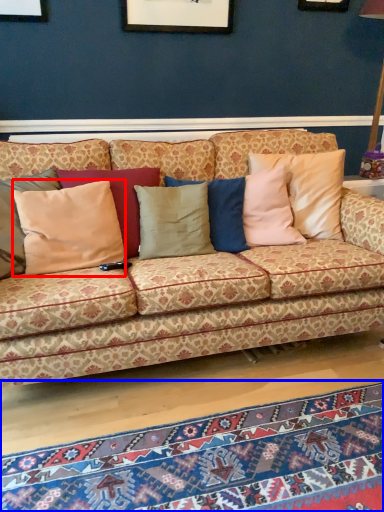
Question: Which point is closer to the camera, pillow (highlighted by a red box) or mat (highlighted by a blue box)?

Choices:
 (A) pillow
 (B) mat

Answer: (B)